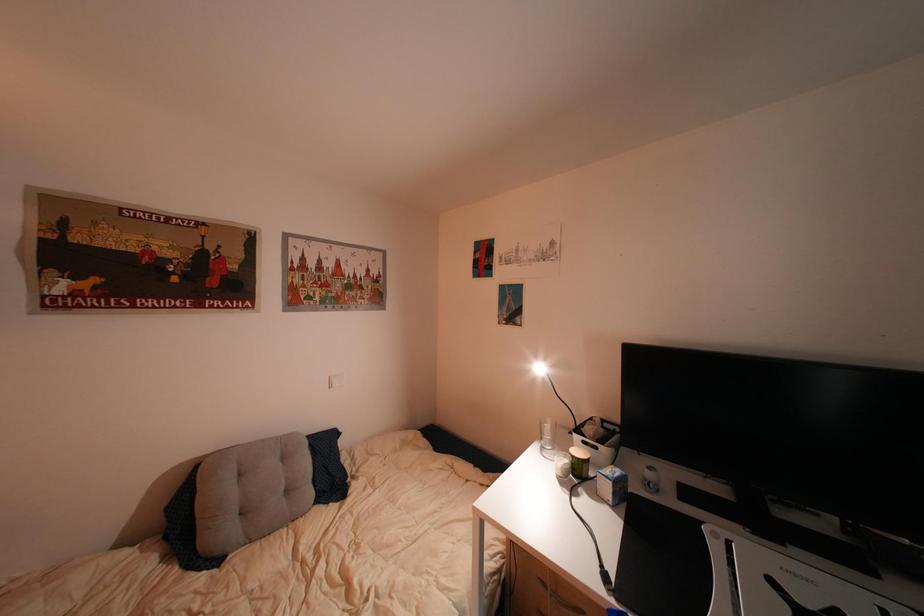
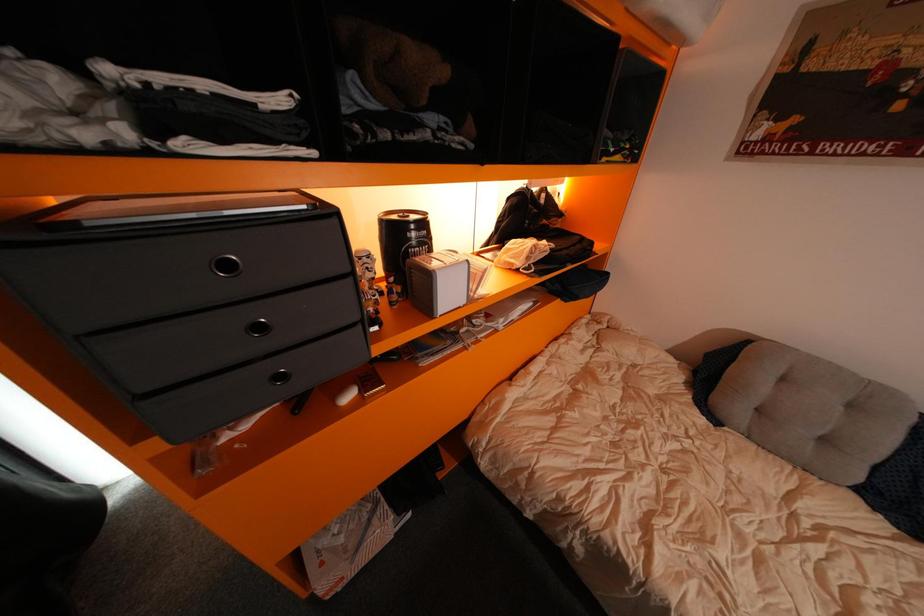
How did the camera likely rotate?

The camera's rotation is toward left-down.